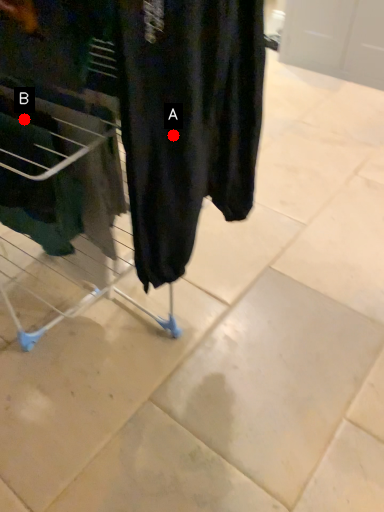
Question: Two points are circled on the image, labeled by A and B beside each circle. Which point appears closest to the camera in this image?

Choices:
 (A) A is closer
 (B) B is closer

Answer: (A)